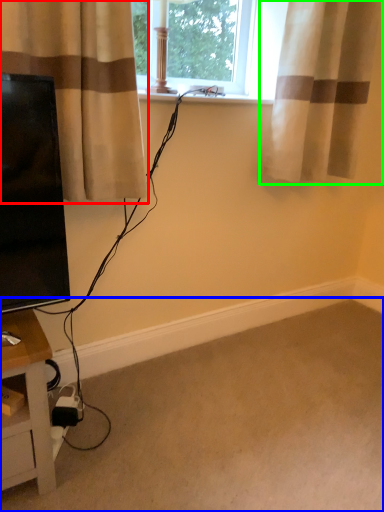
Question: Considering the real-world distances, which object is farthest from curtain (highlighted by a red box)? plain (highlighted by a blue box) or curtain (highlighted by a green box)?

Choices:
 (A) plain
 (B) curtain

Answer: (A)